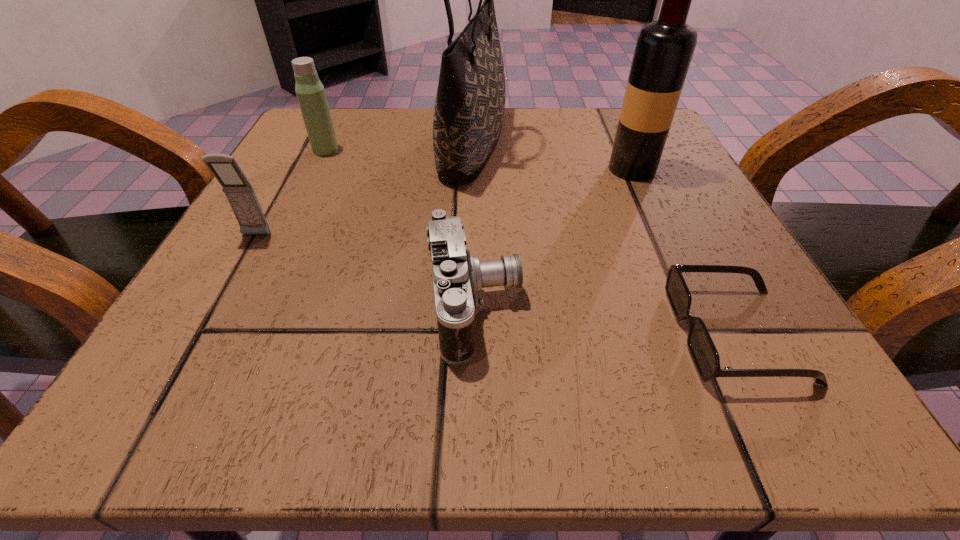
Image resolution: width=960 pixels, height=540 pixels. I want to click on thermos bottle located in the left edge section of the desktop, so click(x=310, y=92).

The height and width of the screenshot is (540, 960). Identify the location of cellular telephone that is at the left edge. (240, 194).

You are a GUI agent. You are given a task and a screenshot of the screen. Output one action in this format:
    pyautogui.click(x=<x>, y=<y>)
    Task: Click on the wine bottle that is positioned at the right edge
    
    Given the screenshot: What is the action you would take?
    pos(664,48)

The height and width of the screenshot is (540, 960). Identify the location of sunglasses present at the right edge. (705, 356).

At what (x,y) coordinates should I click in order to perform the action: click on object at the far left corner. Please return your answer as a coordinate pair (x, y). This screenshot has width=960, height=540. Looking at the image, I should click on (310, 92).

Where is `object present at the far right corner`? object present at the far right corner is located at coordinates (664, 48).

Identify the location of object positioned at the near right corner. Image resolution: width=960 pixels, height=540 pixels. (705, 356).

The height and width of the screenshot is (540, 960). Find the location of `vacant region at the far edge of the desktop`. vacant region at the far edge of the desktop is located at coordinates (387, 111).

Locate an element on the screen. vacant point at the near edge is located at coordinates (433, 358).

In the image, there is a desktop. In order to click on vacant area at the left edge in this screenshot , I will do `click(276, 190)`.